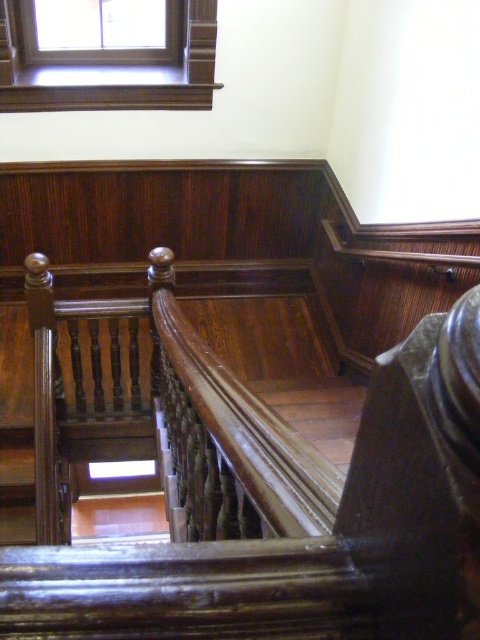
Question: In this image, where is glossy wood handrail at upper center located relative to clear glass window at upper center?

Choices:
 (A) left
 (B) right

Answer: (B)

Question: In this image, where is wooden frame at upper left located relative to clear glass window at upper center?

Choices:
 (A) above
 (B) below

Answer: (B)

Question: Which is nearer to the glossy wood handrail at upper center?

Choices:
 (A) wooden frame at upper left
 (B) clear glass window at upper center

Answer: (A)

Question: Which of the following is the farthest from the observer?

Choices:
 (A) (159, 355)
 (B) (171, 54)
 (C) (129, 90)

Answer: (B)

Question: Among these points, which one is nearest to the camera?

Choices:
 (A) (170, 401)
 (B) (156, 51)

Answer: (A)

Question: In this image, where is glossy wood handrail at upper center located relative to wooden frame at upper left?

Choices:
 (A) above
 (B) below

Answer: (B)